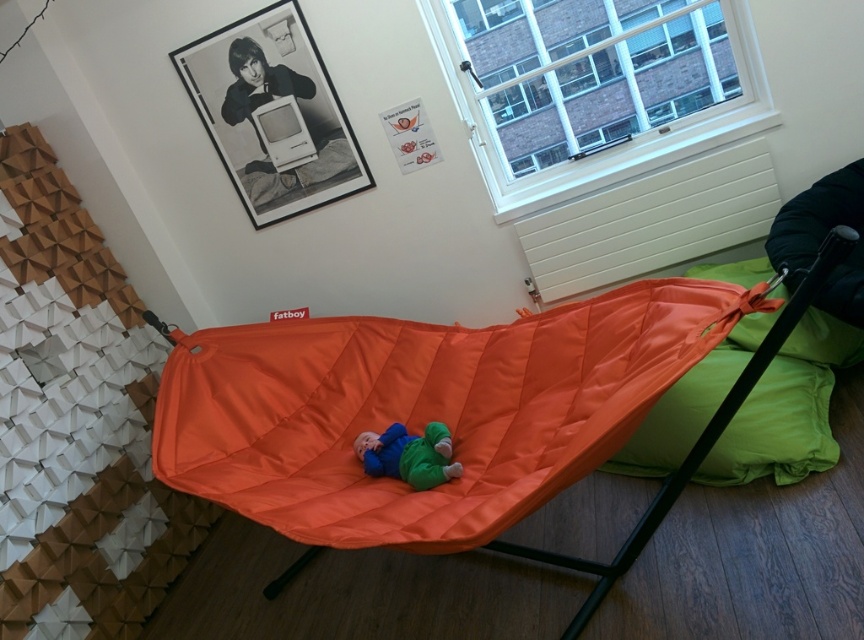
Image resolution: width=864 pixels, height=640 pixels. I want to click on green fabric pillow at lower right, so click(x=776, y=428).

Can you confirm if green fabric pillow at lower right is bigger than matte orange hammock at center?

Yes, green fabric pillow at lower right is bigger than matte orange hammock at center.

The image size is (864, 640). I want to click on green fabric pillow at lower right, so click(776, 428).

At what (x,y) coordinates should I click in order to perform the action: click on green fabric pillow at lower right. Please return your answer as a coordinate pair (x, y). This screenshot has width=864, height=640. Looking at the image, I should click on (776, 428).

Between orange fabric bean bag chair at right and matte orange hammock at center, which one appears on the left side from the viewer's perspective?

matte orange hammock at center is more to the left.

Where is `orange fabric bean bag chair at right`? The height and width of the screenshot is (640, 864). orange fabric bean bag chair at right is located at coordinates (796, 344).

Find the location of a particular element. This screenshot has height=640, width=864. orange fabric bean bag chair at right is located at coordinates (796, 344).

Measure the distance between green fabric pillow at right and camera.

They are 7.82 feet apart.

Does green fabric pillow at right appear on the left side of matte orange hammock at center?

Incorrect, green fabric pillow at right is not on the left side of matte orange hammock at center.

Between point (746, 282) and point (427, 476), which one is positioned behind?

Positioned behind is point (746, 282).

Locate an element on the screen. This screenshot has height=640, width=864. green fabric pillow at right is located at coordinates (824, 340).